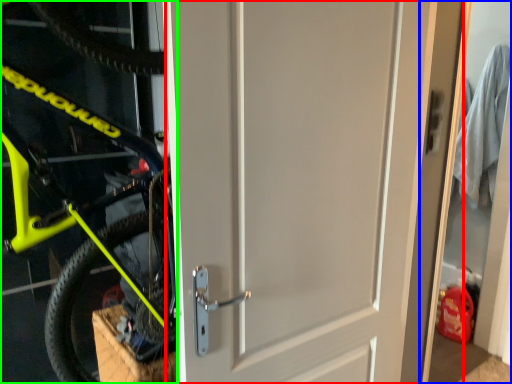
Question: Considering the real-world distances, which object is closest to door (highlighted by a red box)? garage door (highlighted by a blue box) or bicycle (highlighted by a green box).

Choices:
 (A) garage door
 (B) bicycle

Answer: (B)